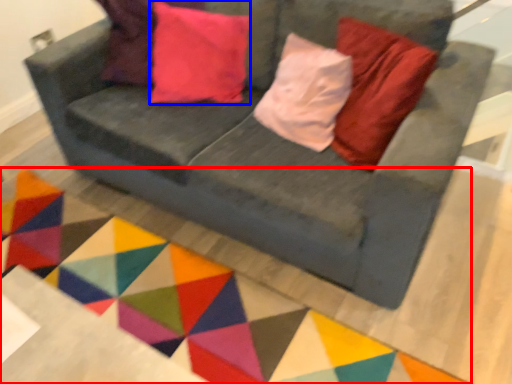
Question: Which point is further to the camera, mat (highlighted by a red box) or pillow (highlighted by a blue box)?

Choices:
 (A) mat
 (B) pillow

Answer: (B)